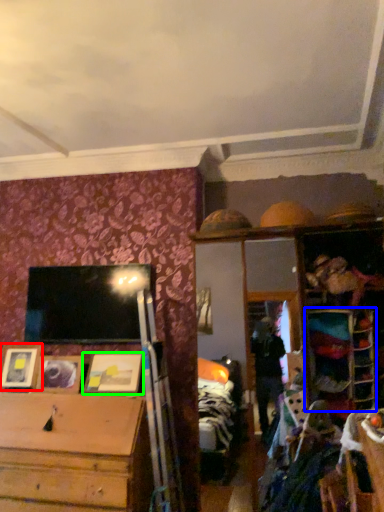
Question: Which object is the farthest from picture frame (highlighted by a red box)? Choose among these: shelf (highlighted by a blue box) or picture frame (highlighted by a green box).

Choices:
 (A) shelf
 (B) picture frame

Answer: (A)